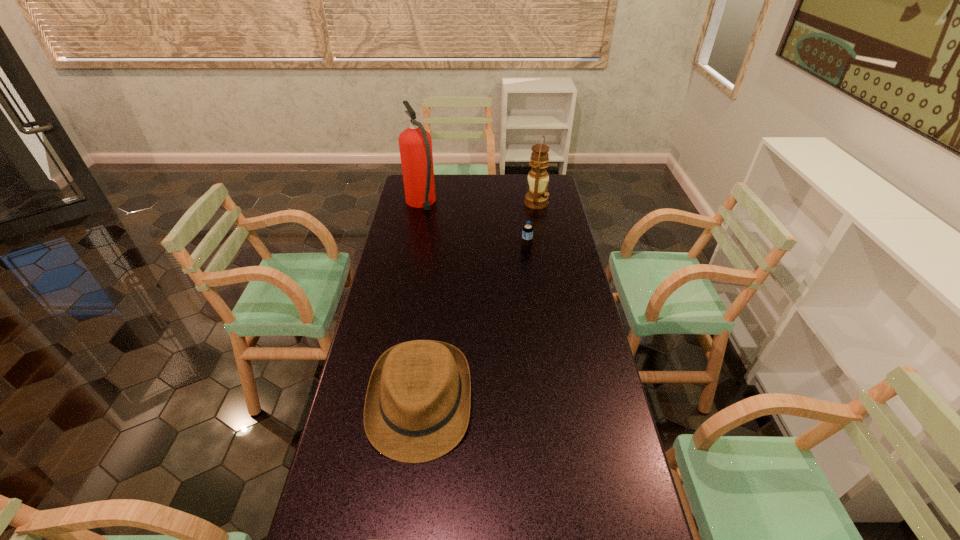
Locate an element on the screen. This screenshot has width=960, height=540. fire extinguisher present at the far edge is located at coordinates (415, 144).

The width and height of the screenshot is (960, 540). In order to click on oil lamp positioned at the far edge in this screenshot , I will do `click(537, 198)`.

Where is `fire extinguisher situated at the left edge`? fire extinguisher situated at the left edge is located at coordinates tap(415, 144).

This screenshot has height=540, width=960. Find the location of `fedora at the left edge`. fedora at the left edge is located at coordinates 417,407.

At what (x,y) coordinates should I click in order to perform the action: click on object present at the right edge. Please return your answer as a coordinate pair (x, y). Looking at the image, I should click on (x=537, y=198).

Find the location of a particular element. This screenshot has width=960, height=540. object that is at the far left corner is located at coordinates (415, 144).

Where is `object positioned at the far right corner`? This screenshot has width=960, height=540. object positioned at the far right corner is located at coordinates (537, 198).

This screenshot has width=960, height=540. What are the coordinates of `vacant position at the far edge of the desktop` in the screenshot? It's located at (525, 192).

What are the coordinates of `free space at the left edge of the desktop` in the screenshot? It's located at (383, 525).

The height and width of the screenshot is (540, 960). What are the coordinates of `blank area at the right edge` in the screenshot? It's located at (581, 278).